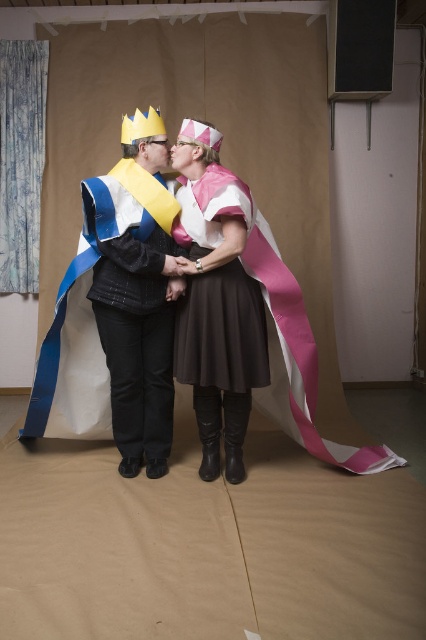
You are a photographer setting up for a group photo. You need to ensure that both the pink satin cape at center and the matte black jacket at center are fully visible in the frame. Based on their heights, which object might require you to adjust your camera angle to avoid being cropped out?

The matte black jacket at center is taller than the pink satin cape at center, so you should adjust the camera angle to ensure the taller matte black jacket at center is fully visible without being cut off.

You are a photographer standing in front of the scene described. You want to capture a closeup shot of the pink satin cape at center without including any other objects in the frame. Given that your camera has a focal length of 85mm and you are currently 10 feet away from the scene, should you move closer or farther away to achieve this?

The pink satin cape at center is 7.68 feet away from the viewer. Since you are currently 10 feet away, you need to move closer to reduce the distance between yourself and the cape to ensure it fills the frame without other objects. Moving closer will allow the cape to occupy more of the frame while keeping the focal length at 85mm.

You are a photographer trying to capture the perfect shot of the scene. You need to position your camera so that the pink satin cape at center is exactly in the center of the frame. Given the coordinates provided, what are the coordinates where you should aim your camera?

The pink satin cape at center is already located at coordinates point (216, 316), so you should aim your camera at those coordinates to center it in the frame.